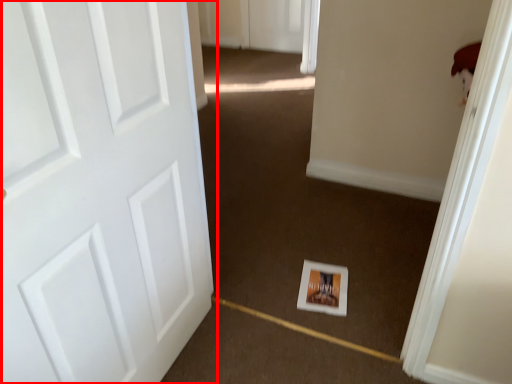
Question: Observing the image, what is the correct spatial positioning of door (annotated by the red box) in reference to postcard?

Choices:
 (A) left
 (B) right

Answer: (A)